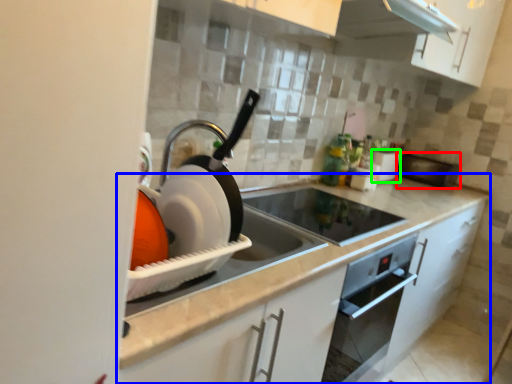
Question: Considering the real-world distances, which object is farthest from appliance (highlighted by a red box)? countertop (highlighted by a blue box) or appliance (highlighted by a green box)?

Choices:
 (A) countertop
 (B) appliance

Answer: (A)